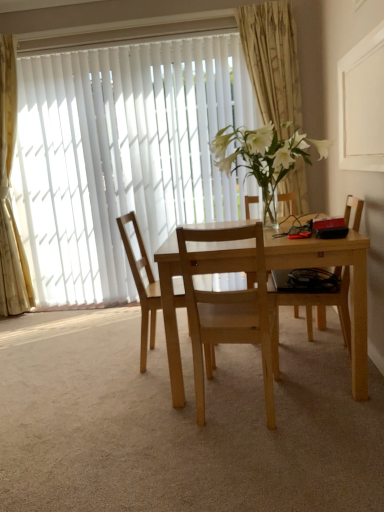
Question: From a real-world perspective, is white vertical blinds at upper left physically located above or below light wood table at center?

Choices:
 (A) above
 (B) below

Answer: (A)

Question: Is white vertical blinds at upper left situated inside light wood table at center or outside?

Choices:
 (A) outside
 (B) inside

Answer: (A)

Question: Which is farther from the white sheer curtain at left, the first curtain viewed from the left?

Choices:
 (A) light wood table at center
 (B) gold textured curtain at upper center, marked as the first curtain in a right-to-left arrangement
 (C) light wood chair at center, which is the second chair in right-to-left order
 (D) light wood chair at right, the 1th chair viewed from the right
 (E) white vertical blinds at upper left

Answer: (D)

Question: Based on their relative distances, which object is nearer to the gold textured curtain at upper center, marked as the first curtain in a right-to-left arrangement?

Choices:
 (A) natural wood chair at center, the first chair in the left-to-right sequence
 (B) white sheer curtain at left, the first curtain viewed from the left
 (C) light wood chair at center, the second chair viewed from the left
 (D) light wood chair at right, placed as the 3th chair when sorted from left to right
 (E) light wood table at center

Answer: (D)